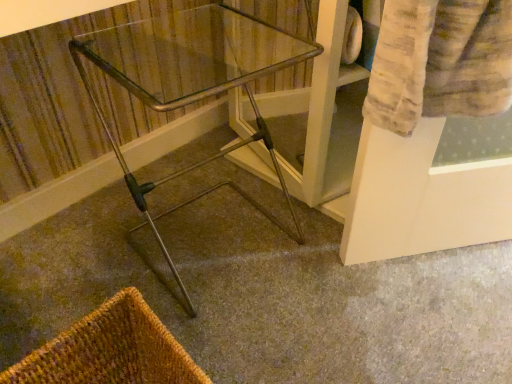
Question: Can we say clear glass table at center lies outside metallic silver walker at center?

Choices:
 (A) yes
 (B) no

Answer: (A)

Question: Is clear glass table at center surrounding metallic silver walker at center?

Choices:
 (A) yes
 (B) no

Answer: (B)

Question: From the image's perspective, is clear glass table at center under metallic silver walker at center?

Choices:
 (A) no
 (B) yes

Answer: (A)

Question: Does clear glass table at center have a larger size compared to metallic silver walker at center?

Choices:
 (A) no
 (B) yes

Answer: (B)

Question: Is clear glass table at center to the right of metallic silver walker at center from the viewer's perspective?

Choices:
 (A) no
 (B) yes

Answer: (A)

Question: From the image's perspective, relative to brown woven basket at lower left, is clear glass table at center above or below?

Choices:
 (A) above
 (B) below

Answer: (A)

Question: Do you think clear glass table at center is within brown woven basket at lower left, or outside of it?

Choices:
 (A) outside
 (B) inside

Answer: (A)

Question: Based on their sizes in the image, would you say clear glass table at center is bigger or smaller than brown woven basket at lower left?

Choices:
 (A) small
 (B) big

Answer: (B)

Question: Considering the positions of clear glass table at center and brown woven basket at lower left in the image, is clear glass table at center taller or shorter than brown woven basket at lower left?

Choices:
 (A) short
 (B) tall

Answer: (B)

Question: In terms of width, does metallic silver walker at center look wider or thinner when compared to brown woven basket at lower left?

Choices:
 (A) thin
 (B) wide

Answer: (B)

Question: Relative to brown woven basket at lower left, is metallic silver walker at center in front or behind?

Choices:
 (A) behind
 (B) front

Answer: (A)

Question: Is point (415, 372) closer or farther from the camera than point (180, 379)?

Choices:
 (A) closer
 (B) farther

Answer: (B)

Question: Based on their sizes in the image, would you say metallic silver walker at center is bigger or smaller than brown woven basket at lower left?

Choices:
 (A) big
 (B) small

Answer: (A)

Question: From a real-world perspective, is metallic silver walker at center positioned above or below clear glass table at center?

Choices:
 (A) above
 (B) below

Answer: (B)

Question: Is metallic silver walker at center inside the boundaries of clear glass table at center, or outside?

Choices:
 (A) inside
 (B) outside

Answer: (B)